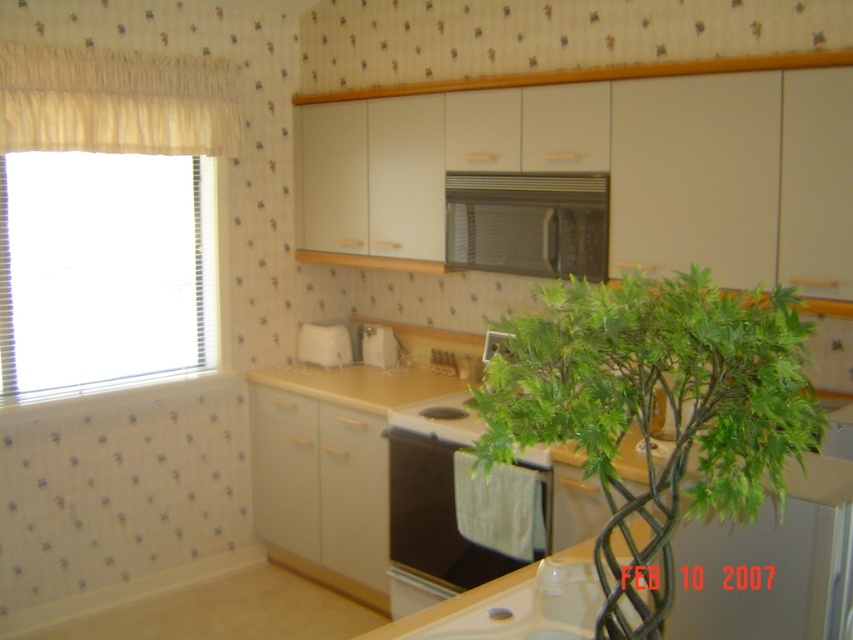
You are standing in the kitchen and want to place a 3ft wide cake on the counter. The point at (x=578, y=221) is where you want to place it. Is there enough space?

The distance between the points is 8.84 feet, which is more than the 3ft width of the cake, so there is enough space to place it at the specified point.

You are standing in the kitchen and need to place a new microwave. The existing black matte microwave at upper center is located at coordinates 0.350, 0.619. Where should you place the new microwave to avoid overlapping with the existing one?

Place the new microwave at coordinates different from (527, 224) to avoid overlapping with the existing black matte microwave at upper center.